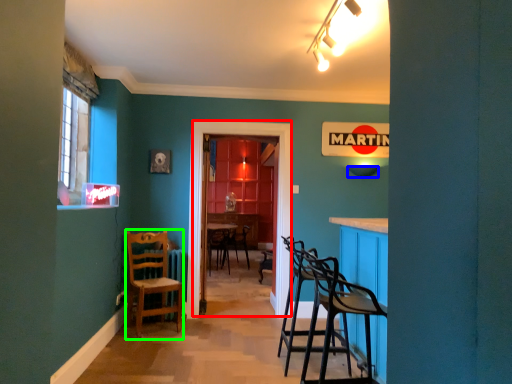
Question: Which object is positioned closest to glass door (highlighted by a red box)? Select from lampshade (highlighted by a blue box) and chair (highlighted by a green box).

Choices:
 (A) lampshade
 (B) chair

Answer: (B)